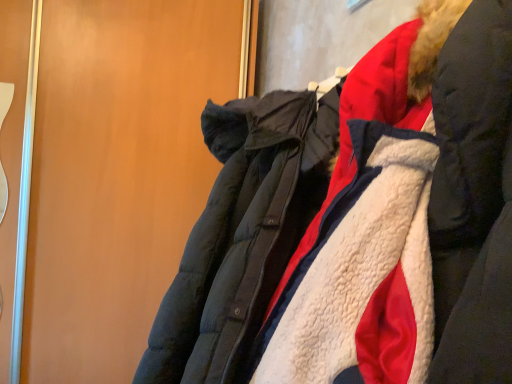
Question: Is white fleece jacket at center next to matte black coat at right and touching it?

Choices:
 (A) yes
 (B) no

Answer: (B)

Question: Does white fleece jacket at center have a smaller size compared to matte black coat at right?

Choices:
 (A) yes
 (B) no

Answer: (A)

Question: From the image's perspective, is white fleece jacket at center under matte black coat at right?

Choices:
 (A) yes
 (B) no

Answer: (A)

Question: Considering the relative sizes of white fleece jacket at center and matte black coat at right in the image provided, is white fleece jacket at center thinner than matte black coat at right?

Choices:
 (A) no
 (B) yes

Answer: (A)

Question: From a real-world perspective, is white fleece jacket at center physically below matte black coat at right?

Choices:
 (A) no
 (B) yes

Answer: (B)

Question: Is white fleece jacket at center positioned in front of matte black coat at right?

Choices:
 (A) yes
 (B) no

Answer: (A)

Question: From the image's perspective, would you say matte black coat at right is shown under white fleece jacket at center?

Choices:
 (A) yes
 (B) no

Answer: (B)

Question: From a real-world perspective, is matte black coat at right below white fleece jacket at center?

Choices:
 (A) yes
 (B) no

Answer: (B)

Question: Does matte black coat at right come behind white fleece jacket at center?

Choices:
 (A) yes
 (B) no

Answer: (A)

Question: Is white fleece jacket at center inside matte black coat at right?

Choices:
 (A) no
 (B) yes

Answer: (A)

Question: Is matte black coat at right to the left of white fleece jacket at center from the viewer's perspective?

Choices:
 (A) yes
 (B) no

Answer: (A)

Question: Can you see matte black coat at right touching white fleece jacket at center?

Choices:
 (A) no
 (B) yes

Answer: (A)

Question: From the image's perspective, is matte black coat at right located above or below white fleece jacket at center?

Choices:
 (A) above
 (B) below

Answer: (A)